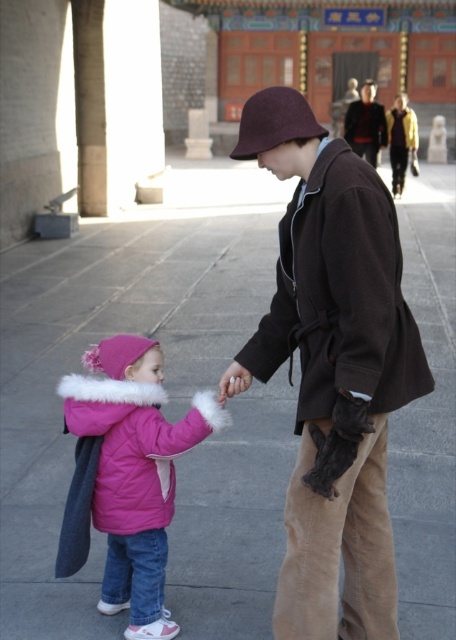
Question: Which object appears closest to the camera in this image?

Choices:
 (A) brown woolen coat at center
 (B) matte pink puffer jacket at lower left
 (C) dark brown leather jacket at upper center
 (D) smooth beige hand at center

Answer: (A)

Question: Which object is farther from the camera taking this photo?

Choices:
 (A) gray concrete pavement at center
 (B) dark brown leather jacket at upper center
 (C) brown woolen coat at center
 (D) maroon felt hat at center

Answer: (B)

Question: Which point appears farthest from the camera in this image?

Choices:
 (A) (362, 150)
 (B) (8, 496)
 (C) (133, 564)
 (D) (384, 333)

Answer: (A)

Question: Does brown woolen coat at center have a larger size compared to matte pink puffer jacket at lower left?

Choices:
 (A) no
 (B) yes

Answer: (B)

Question: Does maroon felt hat at center have a smaller size compared to dark brown leather jacket at upper center?

Choices:
 (A) no
 (B) yes

Answer: (B)

Question: Where is maroon felt hat at center located in relation to dark brown leather jacket at upper center in the image?

Choices:
 (A) below
 (B) above

Answer: (A)